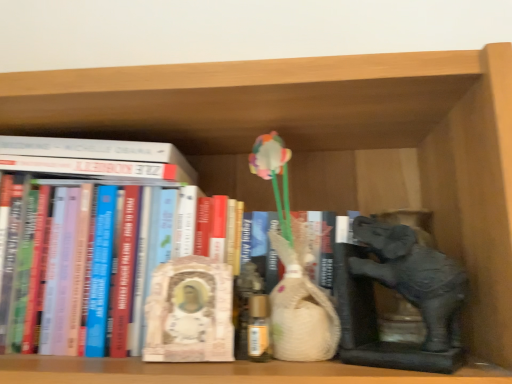
Question: Can you confirm if hardcover book at center, which appears as the second book when viewed from the top, is bigger than white marble statue at center?

Choices:
 (A) no
 (B) yes

Answer: (B)

Question: Is hardcover book at center, the first book from the bottom, thinner than white marble statue at center?

Choices:
 (A) yes
 (B) no

Answer: (B)

Question: From the image's perspective, is hardcover book at center, the first book from the bottom, located beneath white marble statue at center?

Choices:
 (A) no
 (B) yes

Answer: (A)

Question: Considering the relative sizes of hardcover book at center, which appears as the second book when viewed from the top, and white marble statue at center in the image provided, is hardcover book at center, which appears as the second book when viewed from the top, wider than white marble statue at center?

Choices:
 (A) yes
 (B) no

Answer: (A)

Question: Is hardcover book at center, which appears as the second book when viewed from the top, not within white marble statue at center?

Choices:
 (A) yes
 (B) no

Answer: (A)

Question: Does hardcover book at center, which appears as the second book when viewed from the top, come behind white marble statue at center?

Choices:
 (A) no
 (B) yes

Answer: (A)

Question: Does white matte book at upper left, the second book positioned from the bottom, have a smaller size compared to matte gray elephant at right?

Choices:
 (A) yes
 (B) no

Answer: (B)

Question: Is white matte book at upper left, the second book positioned from the bottom, bigger than matte gray elephant at right?

Choices:
 (A) no
 (B) yes

Answer: (B)

Question: From a real-world perspective, is white matte book at upper left, the second book positioned from the bottom, located higher than matte gray elephant at right?

Choices:
 (A) no
 (B) yes

Answer: (B)

Question: Is white matte book at upper left, the second book positioned from the bottom, not within matte gray elephant at right?

Choices:
 (A) no
 (B) yes

Answer: (B)

Question: Is white matte book at upper left, the second book positioned from the bottom, behind matte gray elephant at right?

Choices:
 (A) no
 (B) yes

Answer: (B)

Question: Is white matte book at upper left, the second book positioned from the bottom, at the left side of matte gray elephant at right?

Choices:
 (A) yes
 (B) no

Answer: (A)

Question: From the image's perspective, is matte gray elephant at right beneath hardcover book at center, which appears as the second book when viewed from the top?

Choices:
 (A) no
 (B) yes

Answer: (B)